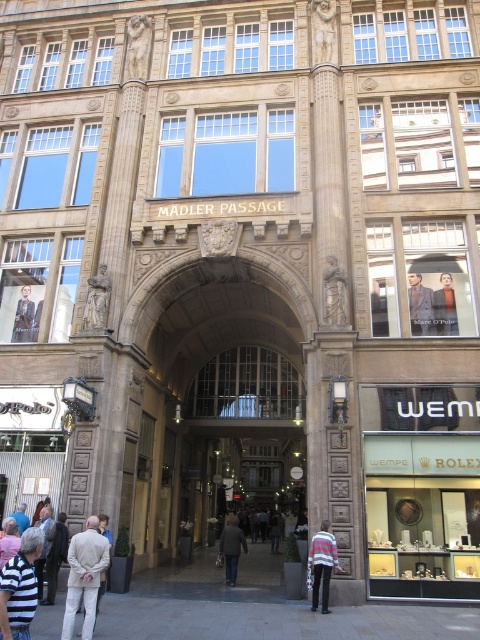
You are a customer browsing the Marc O Pilo store and see the striped fabric jacket at lower left and the dark gray coat at center. Which item is closer to the Polo sign?

The striped fabric jacket at lower left is closer to the Polo sign because it is positioned on the left side of the dark gray coat at center, and the Polo sign is on the left side of the image.

You are a customer looking for a coat and a shirt. The striped cotton shirt at lower left and the dark gray coat at center are both in your line of sight. Which item is positioned more to the left?

The striped cotton shirt at lower left is positioned more to the left than the dark gray coat at center.